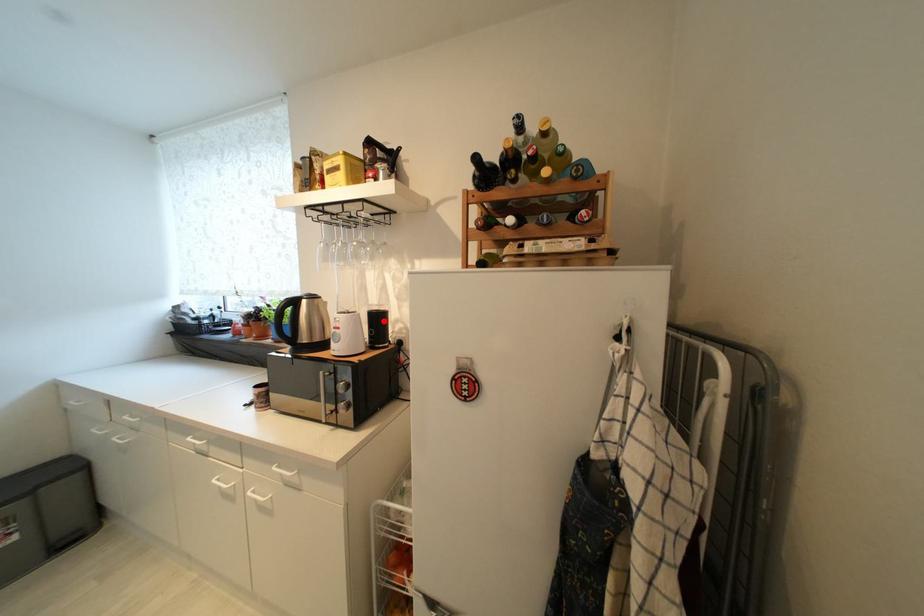
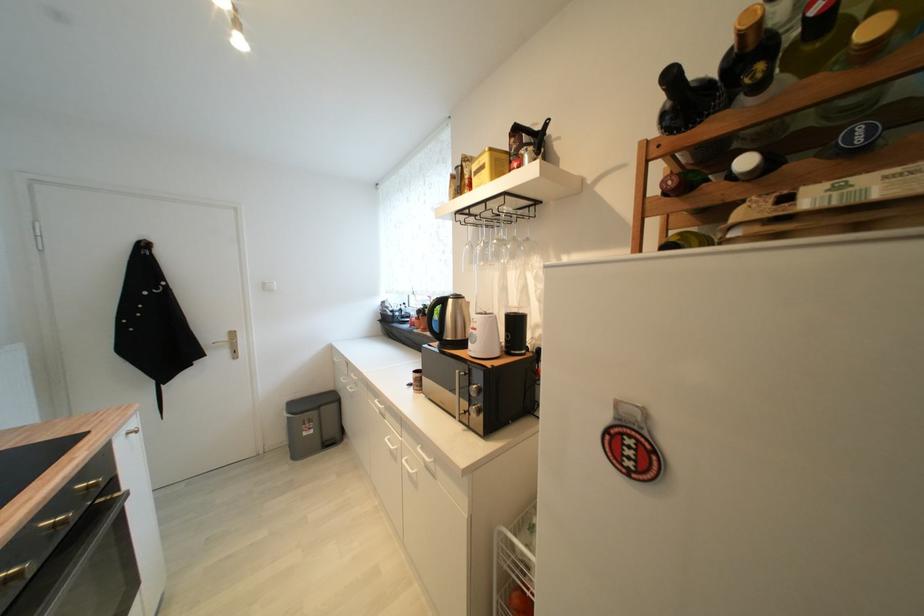
Locate, in the second image, the point that corresponds to the highlighted location in the first image.

(521, 325)